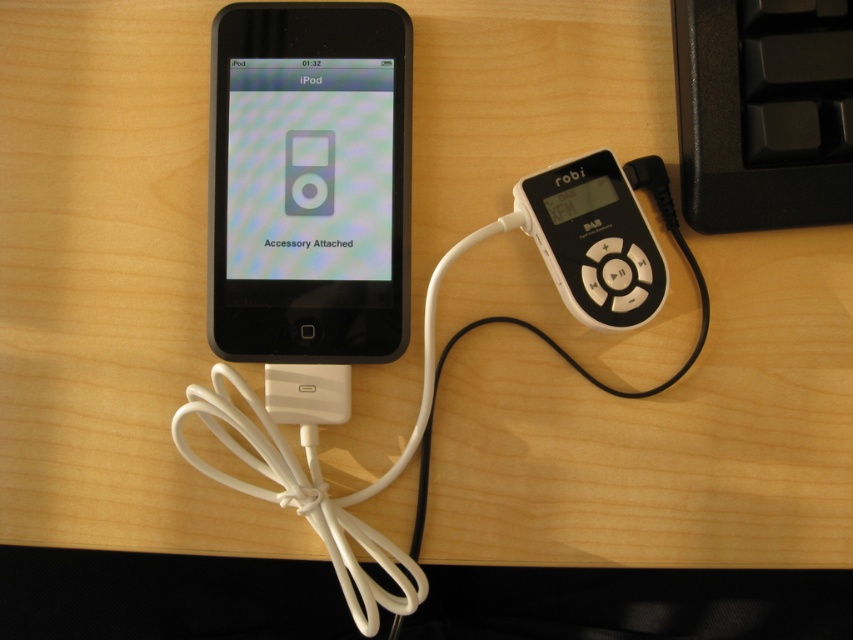
Question: Does white plastic cable at center have a lesser width compared to white plastic mp3 player at center-right?

Choices:
 (A) no
 (B) yes

Answer: (A)

Question: Among these objects, which one is nearest to the camera?

Choices:
 (A) black glossy ipod at left
 (B) white plastic mp3 player at center-right
 (C) white plastic cable at center

Answer: (C)

Question: From the image, what is the correct spatial relationship of black glossy ipod at left in relation to satin black ipod at center?

Choices:
 (A) right
 (B) left

Answer: (A)

Question: Does white plastic cable at center have a larger size compared to satin black ipod at center?

Choices:
 (A) no
 (B) yes

Answer: (B)

Question: Which object appears farthest from the camera in this image?

Choices:
 (A) white plastic cable at center
 (B) satin black ipod at center
 (C) white plastic mp3 player at center-right
 (D) black glossy ipod at left

Answer: (B)

Question: Which object is positioned farthest from the black glossy ipod at left?

Choices:
 (A) white plastic mp3 player at center-right
 (B) white plastic cable at center

Answer: (A)